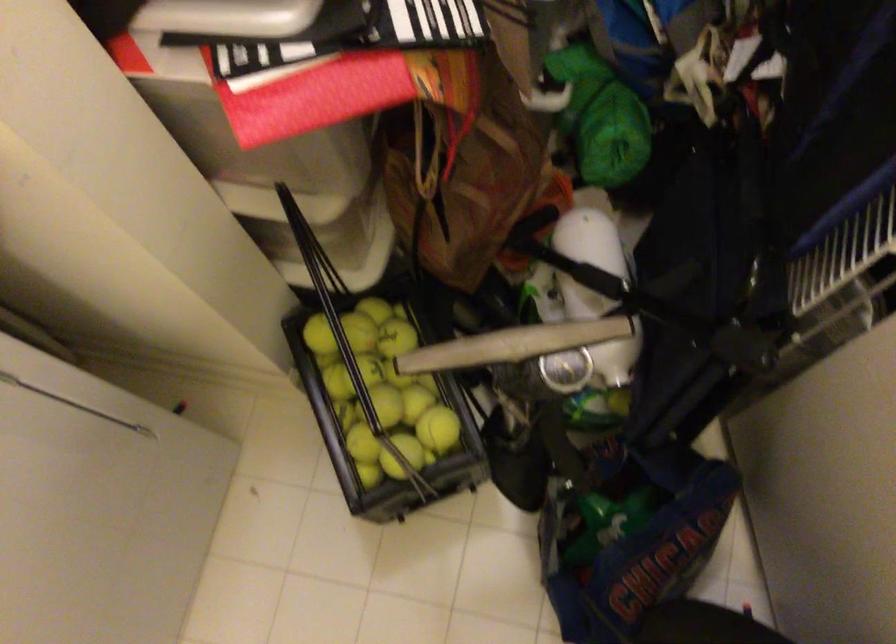
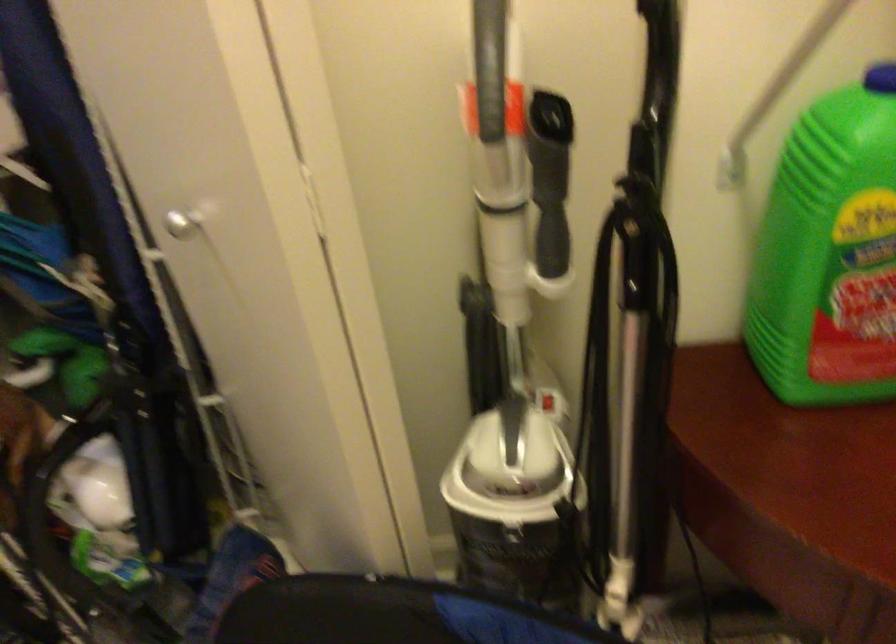
First-person continuous shooting, in which direction is the camera rotating?

The rotation direction of the camera is right-up.